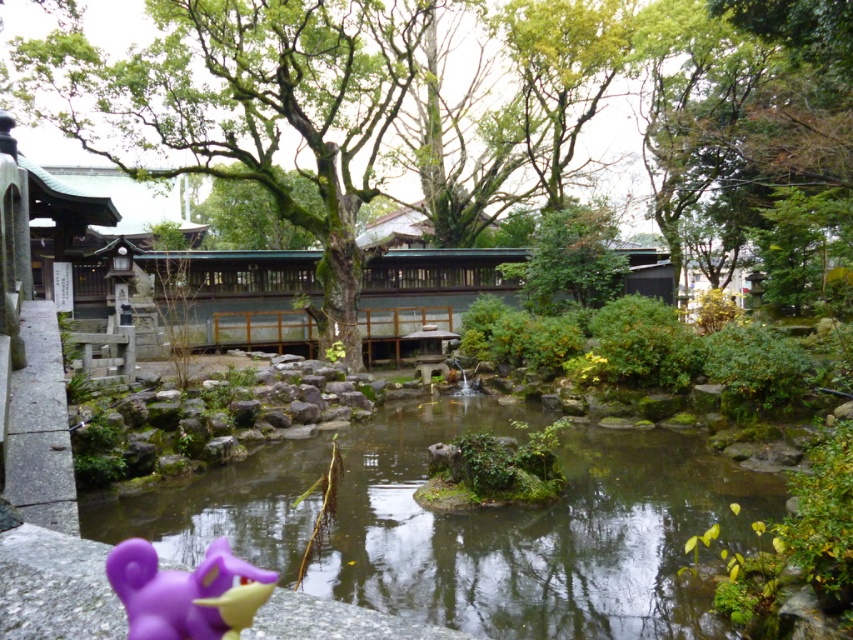
Question: Does clear water stream at center lie in front of purple matte toy at lower left?

Choices:
 (A) no
 (B) yes

Answer: (A)

Question: Which object is the closest to the clear water stream at center?

Choices:
 (A) green mossy tree at center
 (B) purple matte toy at lower left

Answer: (B)

Question: Is green mossy tree at center closer to the viewer compared to purple matte toy at lower left?

Choices:
 (A) yes
 (B) no

Answer: (B)

Question: Which object appears farthest from the camera in this image?

Choices:
 (A) clear water stream at center
 (B) green mossy tree at center

Answer: (B)

Question: Can you confirm if green mossy tree at center is smaller than purple matte toy at lower left?

Choices:
 (A) no
 (B) yes

Answer: (A)

Question: Among these points, which one is farthest from the camera?

Choices:
 (A) (648, 577)
 (B) (28, 67)
 (C) (142, 557)

Answer: (B)